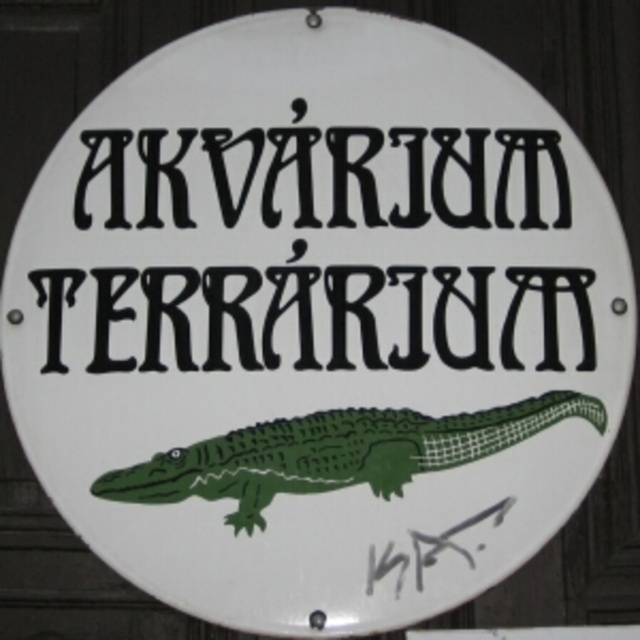
In the scene shown: You are standing in front of the circular signboard. There are two points marked on the signboard. The first point is at coordinates point [164,184] and the second point is at point [266,480]. Which point is closer to you?

Point [266,480] is closer to you because it is in front of point [164,184].